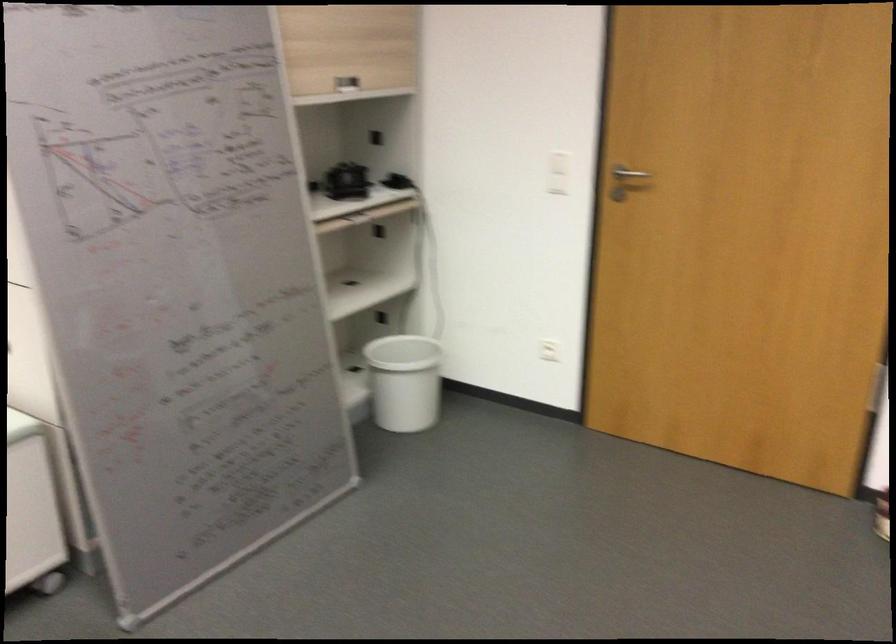
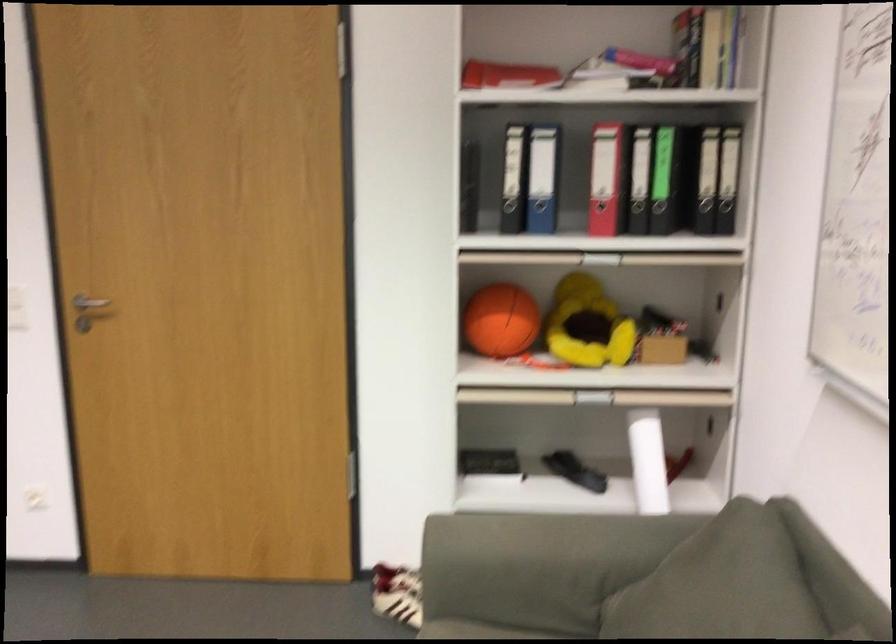
Question: The camera is either moving clockwise (left) or counter-clockwise (right) around the object. The first image is from the beginning of the video and the second image is from the end. Is the camera moving left or right when shooting the video?

Choices:
 (A) Left
 (B) Right

Answer: (A)